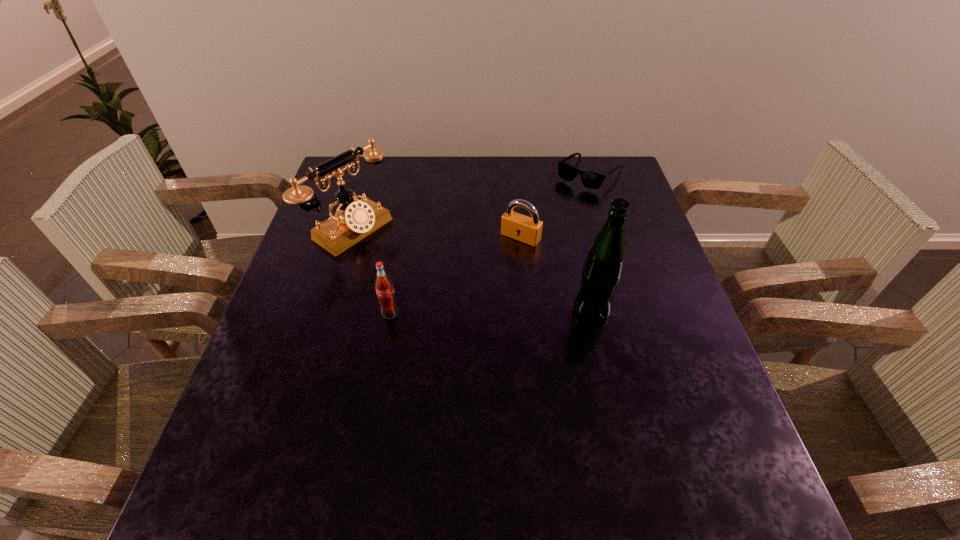
What are the coordinates of `the second object from left to right` in the screenshot? It's located at (385, 292).

The image size is (960, 540). I want to click on soda bottle, so click(385, 292).

This screenshot has width=960, height=540. Find the location of `the tallest object`. the tallest object is located at coordinates (601, 273).

The image size is (960, 540). I want to click on telephone, so click(354, 220).

I want to click on the fourth shortest object, so click(x=354, y=220).

I want to click on padlock, so click(x=525, y=229).

Image resolution: width=960 pixels, height=540 pixels. Find the location of `the second shortest object`. the second shortest object is located at coordinates (525, 229).

Locate an element on the screen. sunglasses is located at coordinates (592, 180).

You are a GUI agent. You are given a task and a screenshot of the screen. Output one action in this format:
    pyautogui.click(x=<x>, y=<y>)
    Task: Click on the farthest object
    
    Given the screenshot: What is the action you would take?
    pyautogui.click(x=592, y=180)

At what (x,y) coordinates should I click in order to perform the action: click on vacant space situated 0.240m on the label of the third shortest object. Please return your answer as a coordinate pair (x, y). Image resolution: width=960 pixels, height=540 pixels. Looking at the image, I should click on (371, 421).